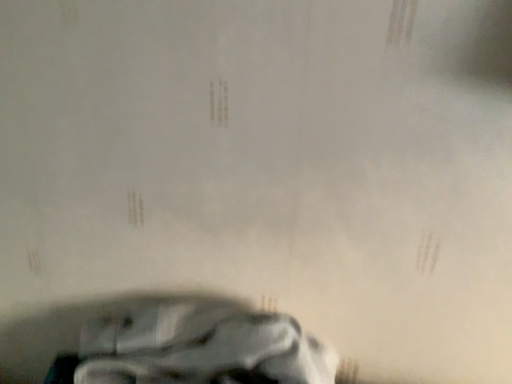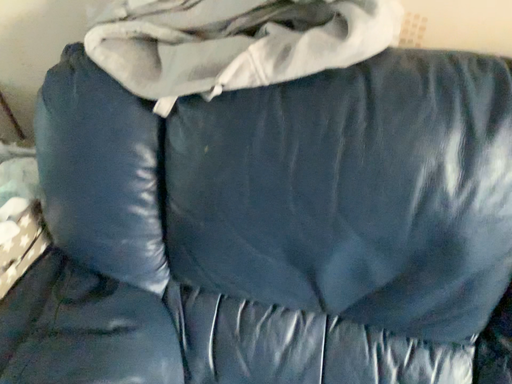
Question: How did the camera likely rotate when shooting the video?

Choices:
 (A) rotated upward
 (B) rotated downward

Answer: (B)